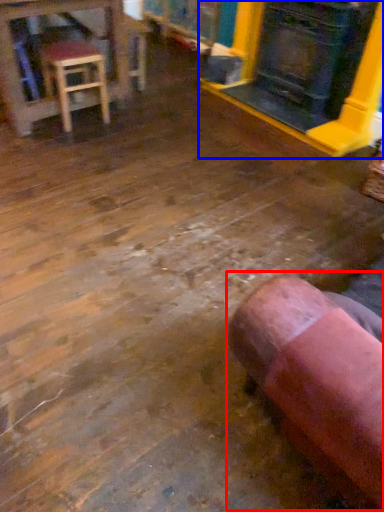
Question: Among these objects, which one is farthest to the camera, bean bag chair (highlighted by a red box) or fireplace (highlighted by a blue box)?

Choices:
 (A) bean bag chair
 (B) fireplace

Answer: (B)